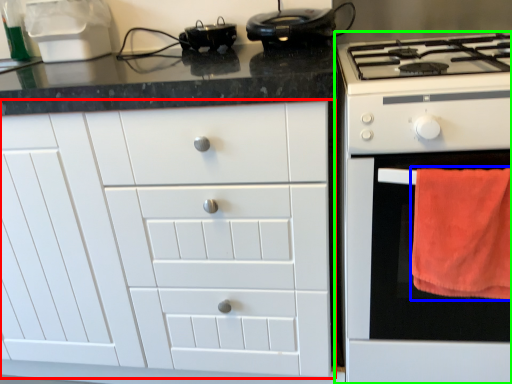
Question: Which is nearer to the cabinetry (highlighted by a red box)? beach towel (highlighted by a blue box) or home appliance (highlighted by a green box).

Choices:
 (A) beach towel
 (B) home appliance

Answer: (B)